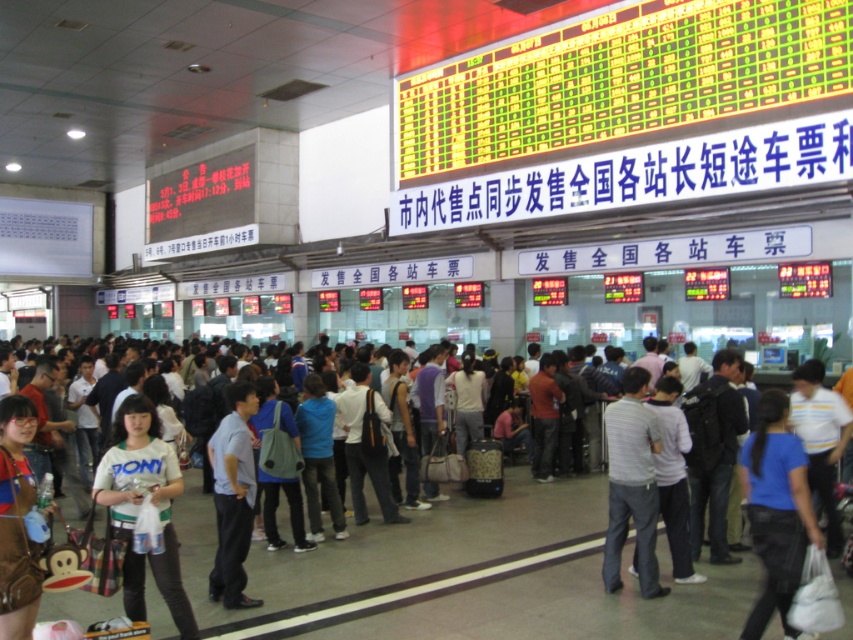
From the picture: You are a traveler standing in the ticketing area and need to choose between moving towards point A at point [757,424] or point B at point [10,550]. Which point is closer to you?

Point B at point [10,550] is closer to you because it is less further away than point A at point [757,424].

You are a traveler in the ticketing area and need to locate the blue cotton shirt at center and denim jacket at lower left. From your vantage point, which clothing item is closer to the floor?

The blue cotton shirt at center is closer to the floor because it is positioned under the denim jacket at lower left.

You are a photographer standing in the ticketing area and want to capture both the blue cotton shirt at center and the denim jacket at lower left in a single frame. Considering their sizes, which one might you need to position closer to the camera to ensure both fit within the frame?

The blue cotton shirt at center is wider than the denim jacket at lower left. To ensure both fit in the frame, you should position the denim jacket at lower left closer to the camera since it is narrower and requires less space, allowing the wider blue cotton shirt at center to be farther back but still visible.